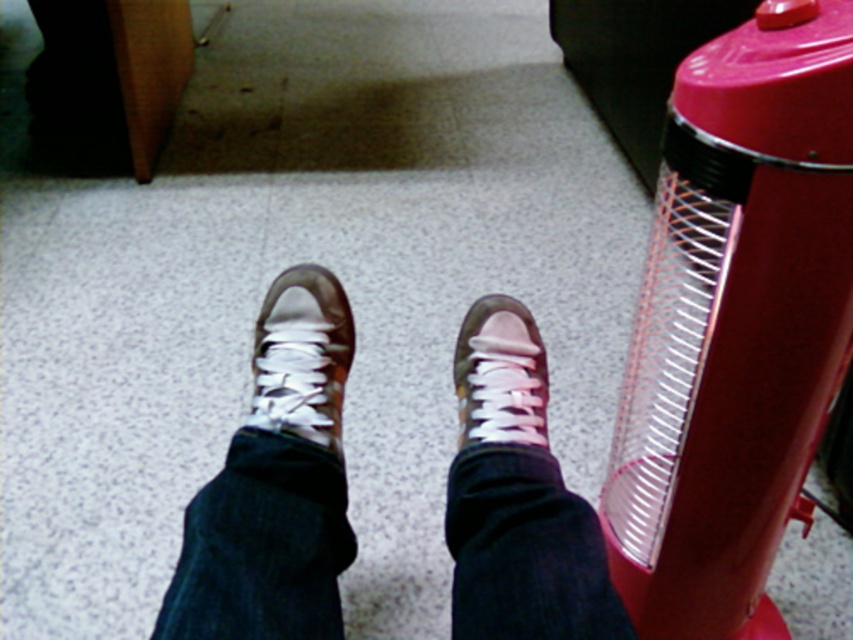
You are trying to place a small plant pot exactly at the center of the room. The room has a coordinate system where the bottom left corner is the origin. Given that the white leather shoe at center is located at point 0.558, 0.355, can you determine if the shoe is closer to the center of the room than to the edge?

The white leather shoe at center is located at point (x=302, y=356). The center of the room would be at coordinates (x=426, y=320). Calculating the distance between the shoe and the center versus the edges, the shoe is closer to the center than to the edges.

You are a photographer trying to capture a closeup of the matte brown sneakers at center. Your camera is positioned at a certain distance. Based on the scene, can you determine if the camera is close enough to focus on the sneakers?

The matte brown sneakers at center and camera are 19.37 inches apart. Since most cameras can focus within this distance, the camera is close enough to focus on the matte brown sneakers at center.